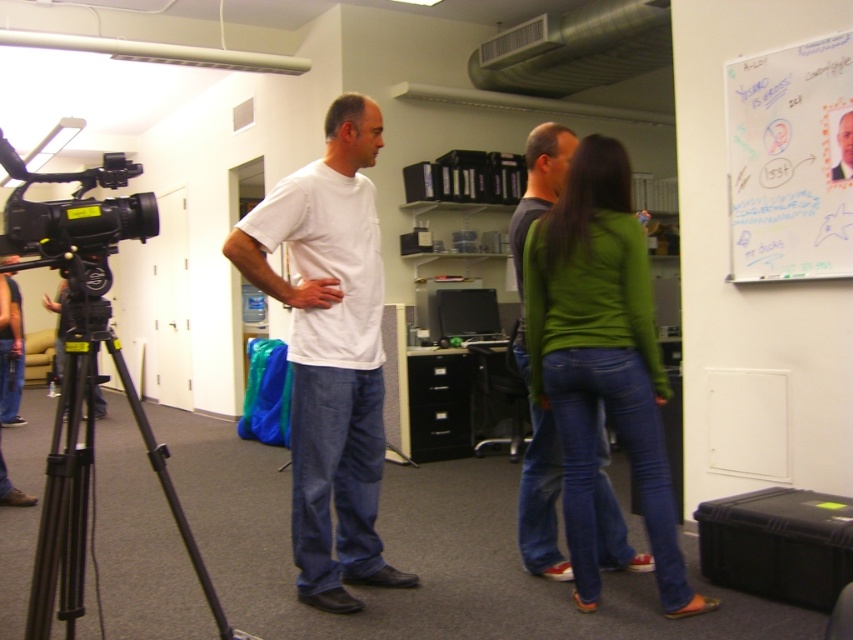
Locate an element on the screen. This screenshot has width=853, height=640. white matte t-shirt at center is located at coordinates (329, 353).

Who is positioned more to the left, white matte t-shirt at center or whiteboard at upper right?

white matte t-shirt at center is more to the left.

Find the location of a particular element. white matte t-shirt at center is located at coordinates (329, 353).

Is white matte t-shirt at center smaller than green matte shirt at center?

No, white matte t-shirt at center is not smaller than green matte shirt at center.

This screenshot has width=853, height=640. What do you see at coordinates (329, 353) in the screenshot? I see `white matte t-shirt at center` at bounding box center [329, 353].

Does point (318, 580) lie in front of point (579, 380)?

No, (318, 580) is behind (579, 380).

At what (x,y) coordinates should I click in order to perform the action: click on white matte t-shirt at center. Please return your answer as a coordinate pair (x, y). Looking at the image, I should click on (329, 353).

Does green matte shirt at center appear under black metal tripod at left?

Actually, green matte shirt at center is above black metal tripod at left.

How much distance is there between green matte shirt at center and black metal tripod at left?

green matte shirt at center and black metal tripod at left are 1.29 meters apart.

The image size is (853, 640). Describe the element at coordinates (601, 362) in the screenshot. I see `green matte shirt at center` at that location.

Find the location of `green matte shirt at center`. green matte shirt at center is located at coordinates (601, 362).